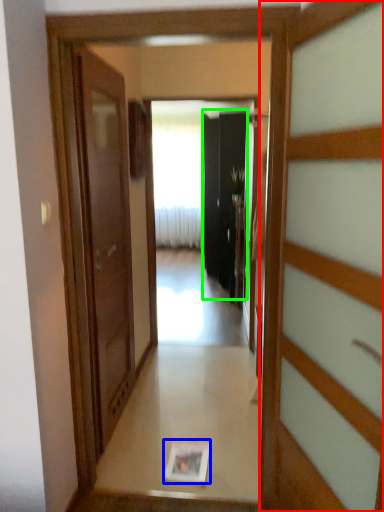
Question: Which object is positioned farthest from door (highlighted by a red box)? Select from magazine (highlighted by a blue box) and screen door (highlighted by a green box).

Choices:
 (A) magazine
 (B) screen door

Answer: (B)